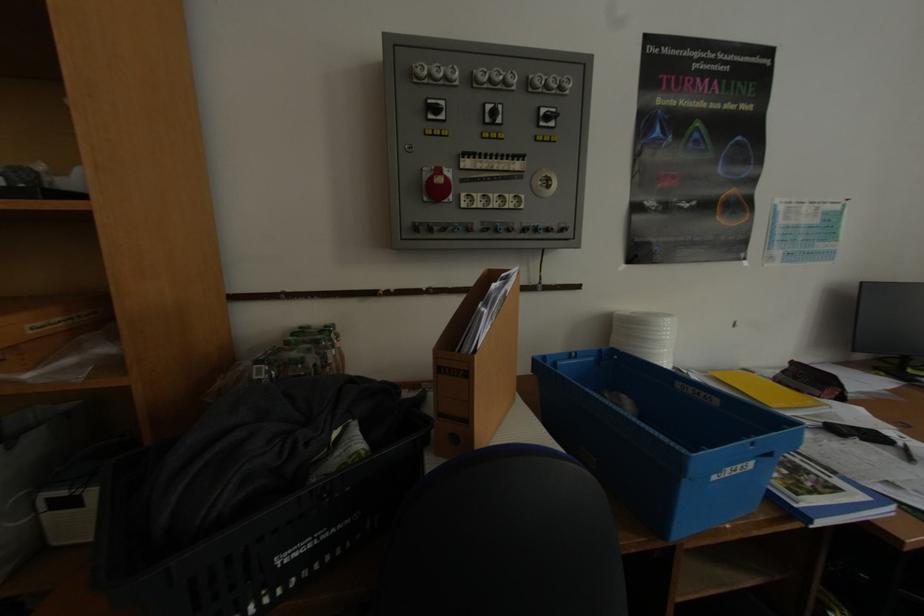
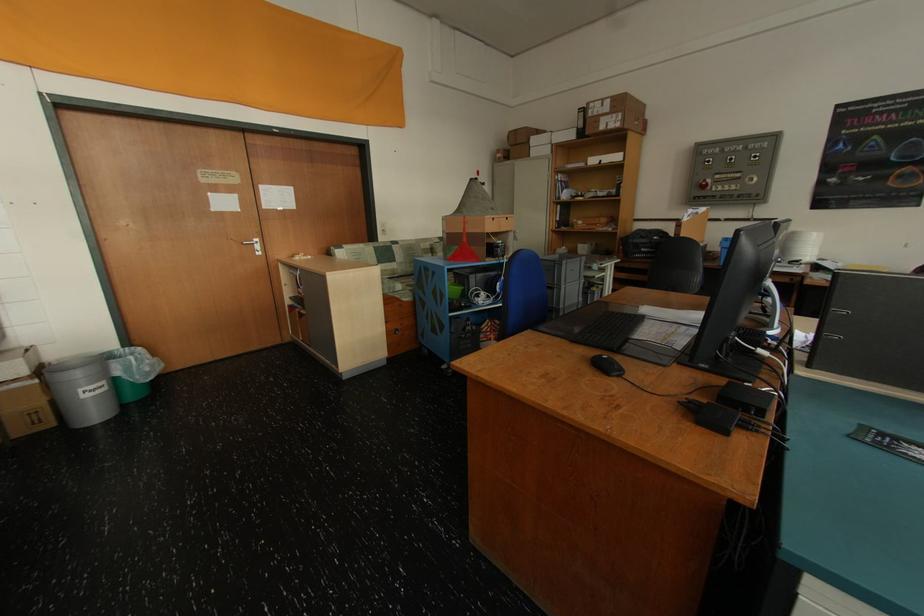
Locate, in the second image, the point that corresponds to point (434, 176) in the first image.

(709, 183)